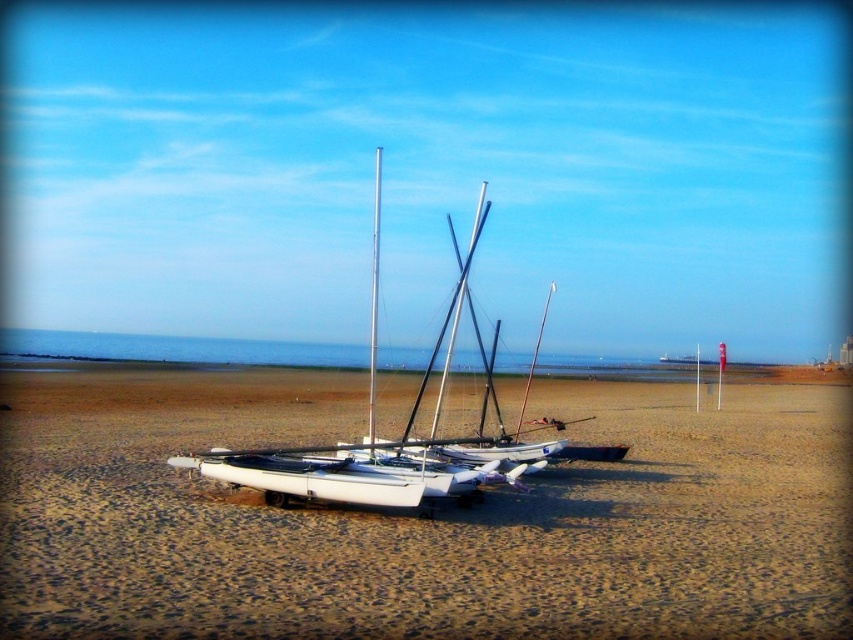
Is white sand at center shorter than silver metallic mast at center?

Correct, white sand at center is not as tall as silver metallic mast at center.

You are a GUI agent. You are given a task and a screenshot of the screen. Output one action in this format:
    pyautogui.click(x=<x>, y=<y>)
    Task: Click on the white sand at center
    The width and height of the screenshot is (853, 640).
    Given the screenshot: What is the action you would take?
    pyautogui.click(x=422, y=520)

The image size is (853, 640). What do you see at coordinates (422, 520) in the screenshot?
I see `white sand at center` at bounding box center [422, 520].

Find the location of a particular element. The image size is (853, 640). white sand at center is located at coordinates (422, 520).